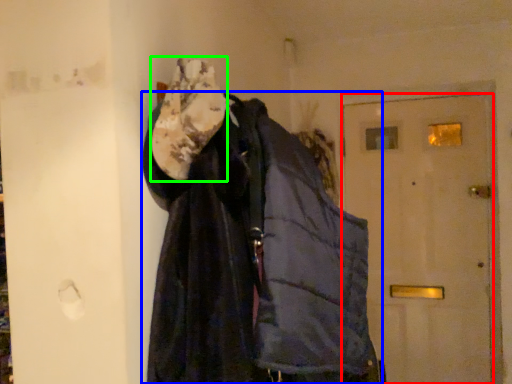
Question: Which is farther away from door (highlighted by a red box)? jacket (highlighted by a blue box) or scarf (highlighted by a green box)?

Choices:
 (A) jacket
 (B) scarf

Answer: (B)